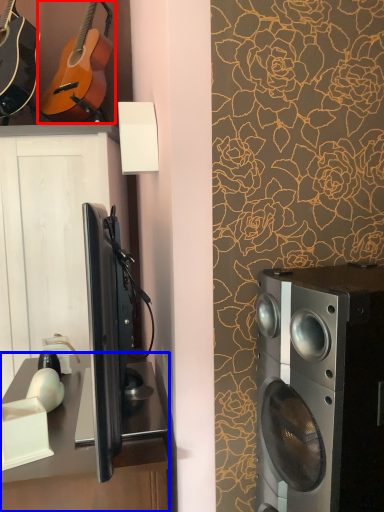
Question: Which object appears farthest to the camera in this image, guitar (highlighted by a red box) or desk (highlighted by a blue box)?

Choices:
 (A) guitar
 (B) desk

Answer: (A)